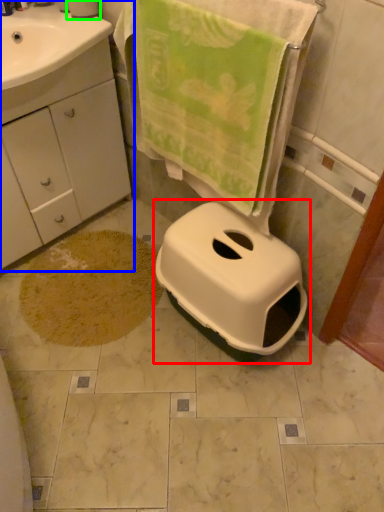
Question: Considering the real-world distances, which object is closest to toilet (highlighted by a red box)? bathroom cabinet (highlighted by a blue box) or toilet paper (highlighted by a green box).

Choices:
 (A) bathroom cabinet
 (B) toilet paper

Answer: (A)